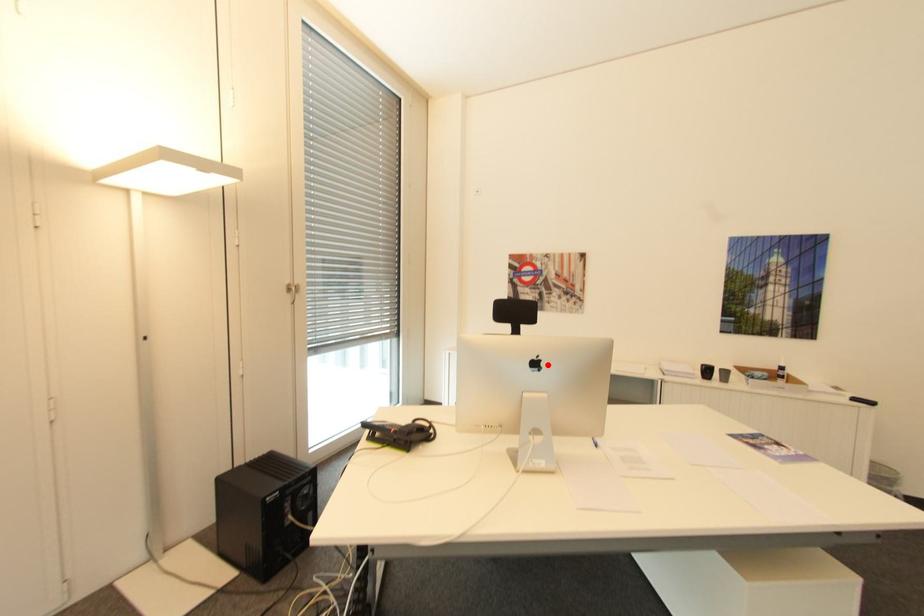
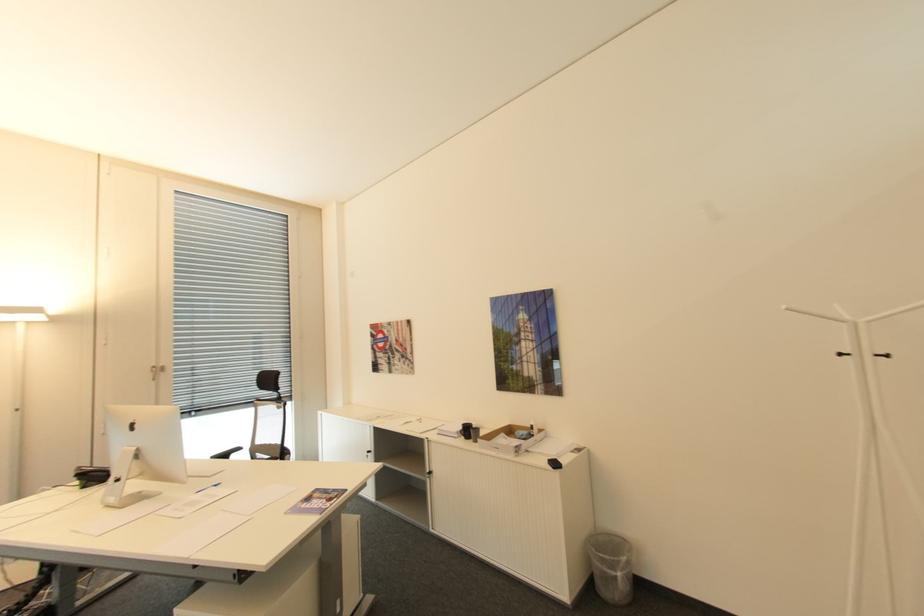
In the second image, find the point that corresponds to the highlighted location in the first image.

(140, 426)